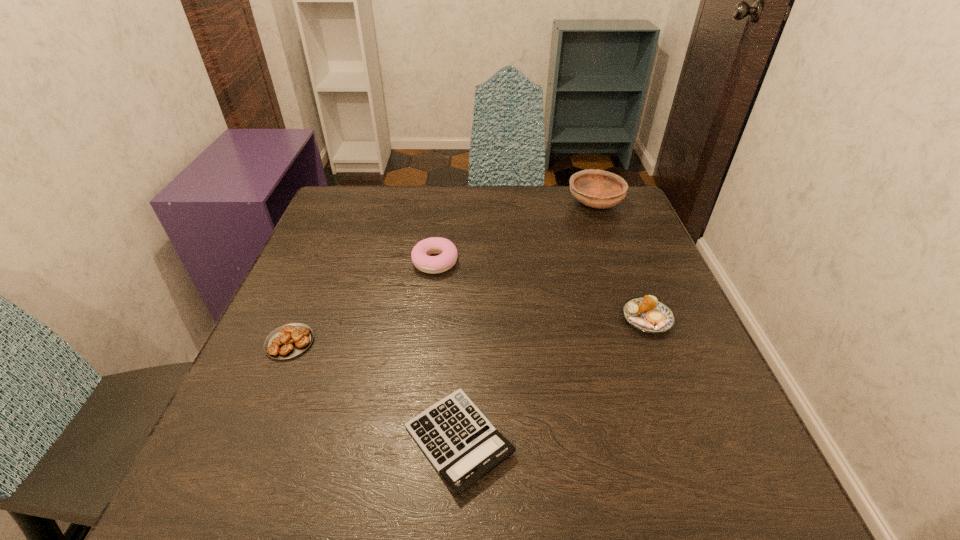
Where is `vacant space that satisfies the following two spatial constraints: 1. on the front side of the second farthest object; 2. on the left side of the nearest object`? Image resolution: width=960 pixels, height=540 pixels. vacant space that satisfies the following two spatial constraints: 1. on the front side of the second farthest object; 2. on the left side of the nearest object is located at coordinates (414, 440).

This screenshot has width=960, height=540. In order to click on free location that satisfies the following two spatial constraints: 1. on the back side of the farthest object; 2. on the left side of the leftmost object in this screenshot , I will do `click(349, 202)`.